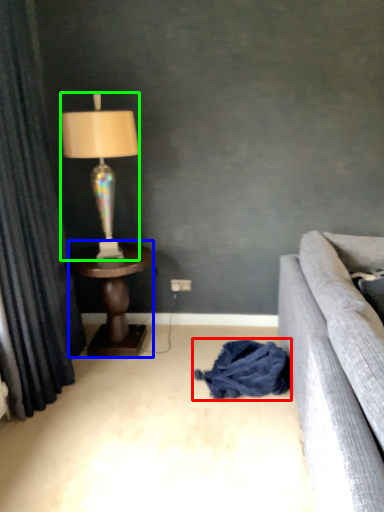
Question: Based on their relative distances, which object is farther from material (highlighted by a red box)? Choose from table (highlighted by a blue box) and lamp (highlighted by a green box).

Choices:
 (A) table
 (B) lamp

Answer: (B)